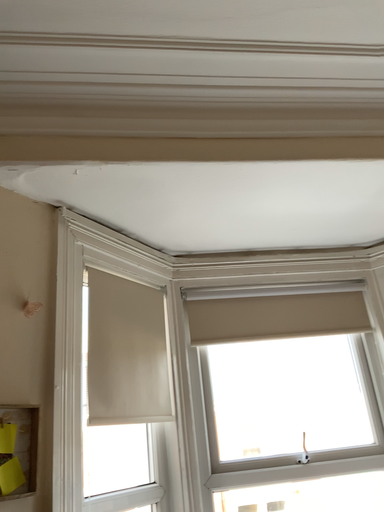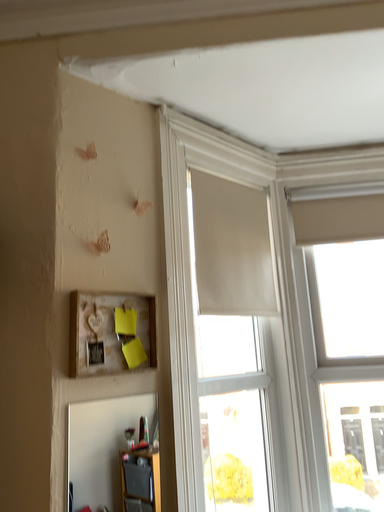
Question: How did the camera likely rotate when shooting the video?

Choices:
 (A) rotated left
 (B) rotated right

Answer: (A)